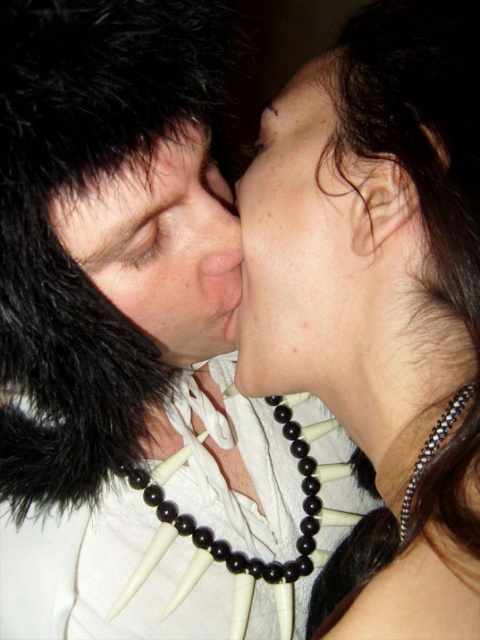
You are a photographer trying to capture the details of the black beaded necklace at upper center and the black fur at upper left in this dimly lit scene. Since the camera can only focus on one object at a time, which object would you choose to ensure the widest part is in focus?

The black beaded necklace at upper center might be wider than black fur at upper left, so you should focus on the black beaded necklace at upper center to capture its widest part.

You are a photographer adjusting the lighting in this scene. You need to ensure that both the black beaded necklace at upper center and the black beaded necklace at center are clearly visible. Which necklace should you focus the light on first to avoid one being obscured by the other?

The black beaded necklace at upper center is positioned over the black beaded necklace at center. Therefore, focusing the light on the lower necklace first will prevent it from being obscured by the upper one.

You are a photographer trying to capture the details of the black beaded necklace at upper center and the black fur at upper left. Which object is positioned to the right side of the other?

The black beaded necklace at upper center is to the right of the black fur at upper left.